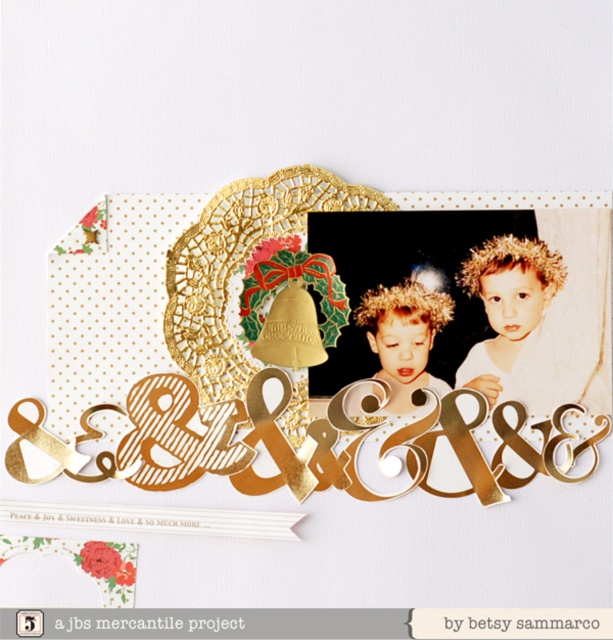
Question: Does blonde hair child at center have a larger size compared to gold glitter hairband at center?

Choices:
 (A) yes
 (B) no

Answer: (A)

Question: Among these objects, which one is nearest to the camera?

Choices:
 (A) matte gold photo frame at center
 (B) gold glitter hairband at center
 (C) blonde hair child at center

Answer: (A)

Question: Is matte gold photo frame at center closer to the viewer compared to gold glitter hairband at center?

Choices:
 (A) no
 (B) yes

Answer: (B)

Question: Does matte gold photo frame at center lie behind blonde hair child at center?

Choices:
 (A) yes
 (B) no

Answer: (B)

Question: Which of the following is the farthest from the observer?

Choices:
 (A) (516, 285)
 (B) (402, 284)

Answer: (B)

Question: Which object is farther from the camera taking this photo?

Choices:
 (A) gold glitter hairband at center
 (B) blonde hair child at center
 (C) matte gold photo frame at center

Answer: (A)